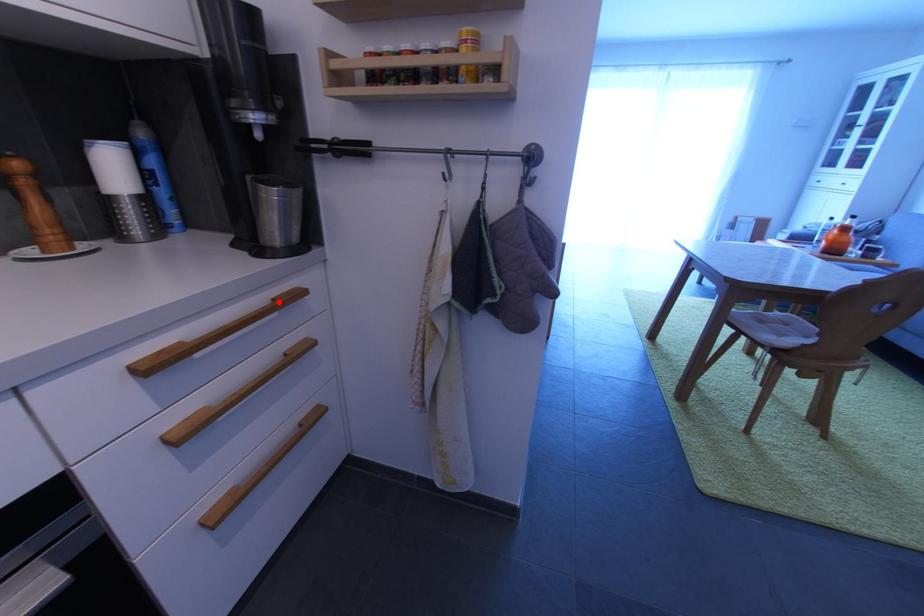
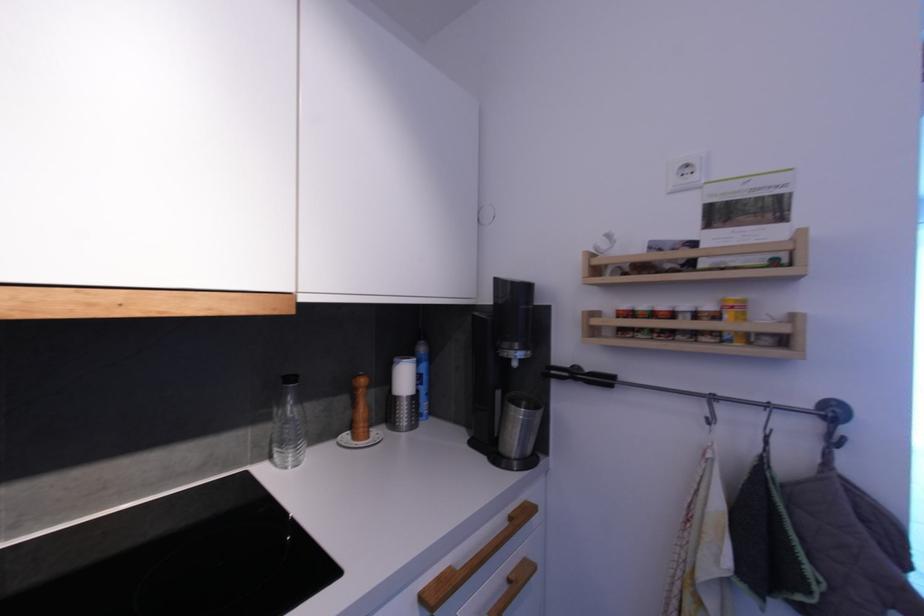
The point at the highlighted location is marked in the first image. Where is the corresponding point in the second image?

(516, 519)